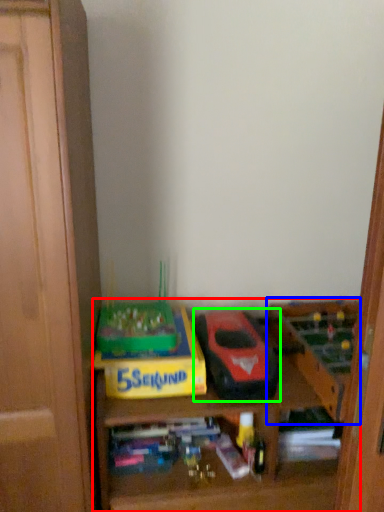
Question: Which object is positioned closest to shelf (highlighted by a red box)? Select from toy (highlighted by a blue box) and model car (highlighted by a green box).

Choices:
 (A) toy
 (B) model car

Answer: (A)